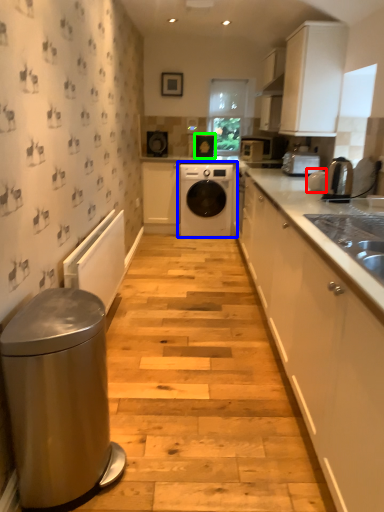
Question: Estimate the real-world distances between objects in this image. Which object is closer to appliance (highlighted by a red box), washing machine (highlighted by a blue box) or appliance (highlighted by a green box)?

Choices:
 (A) washing machine
 (B) appliance

Answer: (A)